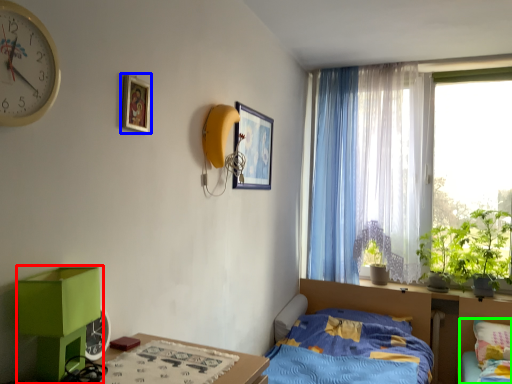
Question: Which object is positioned closest to changing table (highlighted by a red box)? Select from picture frame (highlighted by a blue box) and bed (highlighted by a green box).

Choices:
 (A) picture frame
 (B) bed

Answer: (A)